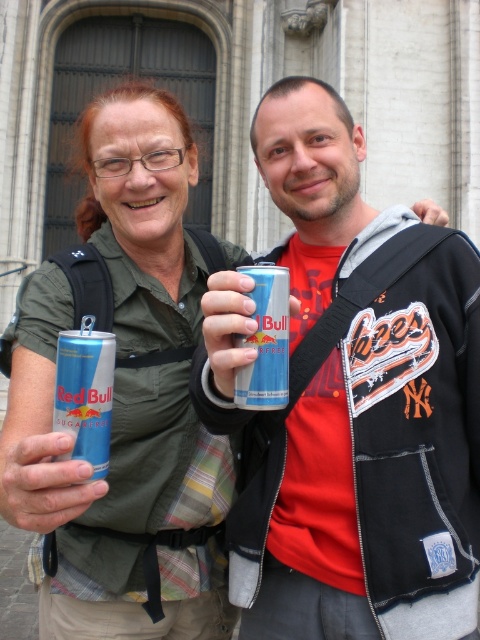
Question: Based on their relative distances, which object is nearer to the metallic blue can at lower left?

Choices:
 (A) matte black sweatshirt at left
 (B) silver metallic can at center

Answer: (B)

Question: Is metallic can at center bigger than metallic blue can at lower left?

Choices:
 (A) no
 (B) yes

Answer: (B)

Question: Estimate the real-world distances between objects in this image. Which object is closer to the metallic blue can at lower left?

Choices:
 (A) metallic can at center
 (B) matte black sweatshirt at left

Answer: (B)

Question: Does metallic can at center appear on the left side of silver metallic can at center?

Choices:
 (A) no
 (B) yes

Answer: (A)

Question: Among these objects, which one is nearest to the camera?

Choices:
 (A) matte black sweatshirt at left
 (B) silver metallic can at center
 (C) metallic can at center

Answer: (B)

Question: Is matte black sweatshirt at left positioned in front of silver metallic can at center?

Choices:
 (A) no
 (B) yes

Answer: (A)